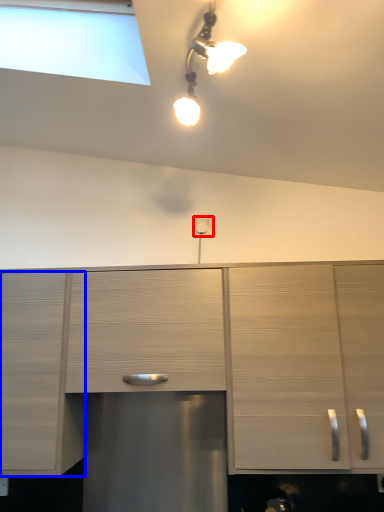
Question: Which object appears farthest to the camera in this image, electric outlet (highlighted by a red box) or cabinetry (highlighted by a blue box)?

Choices:
 (A) electric outlet
 (B) cabinetry

Answer: (A)